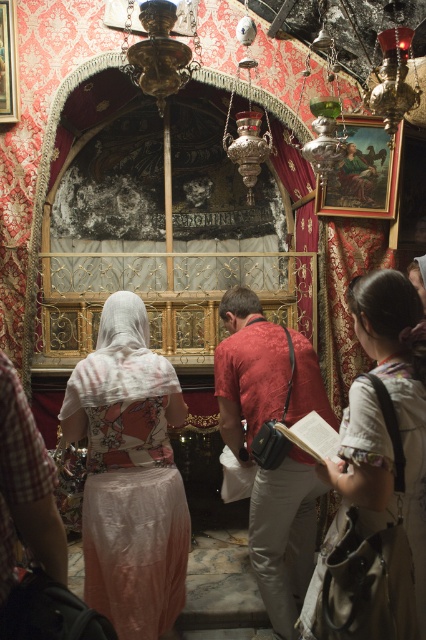
You are standing in the religious site and want to take a photo of the light beige fabric at center and the silky pink dress at center. Which one should you focus on first to ensure both are in focus?

You should focus on the light beige fabric at center first since it is closer to the viewer than the silky pink dress at center, allowing both to be in focus by adjusting the camera appropriately.